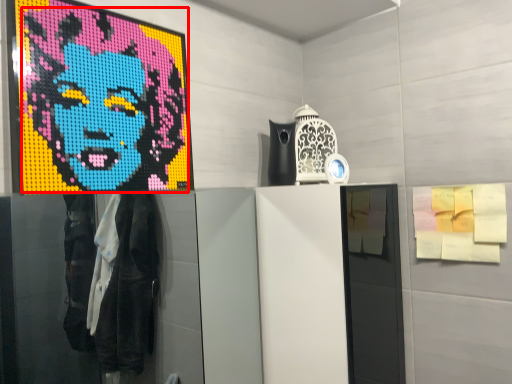
Question: Observing the image, what is the correct spatial positioning of person (annotated by the red box) in reference to poster?

Choices:
 (A) left
 (B) right

Answer: (A)